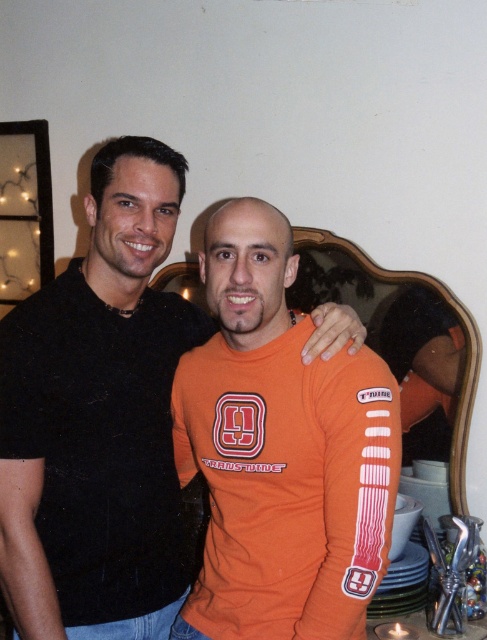
Question: Does orange jersey at center appear under black matte t-shirt at left?

Choices:
 (A) yes
 (B) no

Answer: (A)

Question: Does orange jersey at center lie behind black matte t-shirt at left?

Choices:
 (A) yes
 (B) no

Answer: (B)

Question: Estimate the real-world distances between objects in this image. Which object is closer to the orange jersey at center?

Choices:
 (A) orange matte t-shirt at center
 (B) black matte t-shirt at left

Answer: (B)

Question: Among these points, which one is farthest from the camera?

Choices:
 (A) (133, 176)
 (B) (171, 369)
 (C) (245, 509)

Answer: (B)

Question: Is orange jersey at center to the right of black matte t-shirt at left from the viewer's perspective?

Choices:
 (A) no
 (B) yes

Answer: (B)

Question: Among these objects, which one is farthest from the camera?

Choices:
 (A) orange jersey at center
 (B) orange matte t-shirt at center

Answer: (B)